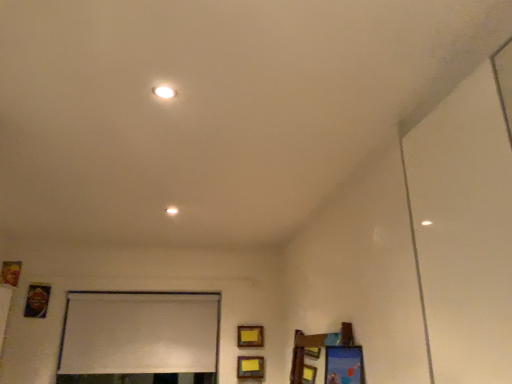
Question: Is metallic gold picture frame at lower left, which ranks as the 3th picture frame in bottom-to-top order, wider than matte yellow picture frame at center, the 2th picture frame from the bottom?

Choices:
 (A) yes
 (B) no

Answer: (A)

Question: Can you confirm if metallic gold picture frame at lower left, which ranks as the 3th picture frame in bottom-to-top order, is bigger than matte yellow picture frame at center, which appears as the fourth picture frame when viewed from the left?

Choices:
 (A) no
 (B) yes

Answer: (B)

Question: Would you say metallic gold picture frame at lower left, which is the 2th picture frame from top to bottom, contains matte yellow picture frame at center, arranged as the 3th picture frame when viewed from the top?

Choices:
 (A) yes
 (B) no

Answer: (B)

Question: Is metallic gold picture frame at lower left, positioned as the 2th picture frame in left-to-right order, not inside matte yellow picture frame at center, arranged as the 3th picture frame when viewed from the top?

Choices:
 (A) yes
 (B) no

Answer: (A)

Question: From the image's perspective, is metallic gold picture frame at lower left, which is the 2th picture frame from top to bottom, on top of matte yellow picture frame at center, arranged as the 3th picture frame when viewed from the top?

Choices:
 (A) yes
 (B) no

Answer: (A)

Question: From the image's perspective, is metallic gold picture frame at lower left, which ranks as the 3th picture frame in bottom-to-top order, beneath matte yellow picture frame at center, which appears as the fourth picture frame when viewed from the left?

Choices:
 (A) yes
 (B) no

Answer: (B)

Question: Is white matte window screen at lower center oriented away from wooden picture frame at left, the fourth picture frame positioned from the right?

Choices:
 (A) yes
 (B) no

Answer: (B)

Question: Is white matte window screen at lower center outside wooden picture frame at left, the first picture frame viewed from the left?

Choices:
 (A) no
 (B) yes

Answer: (B)

Question: Does white matte window screen at lower center have a greater width compared to wooden picture frame at left, the fourth picture frame positioned from the right?

Choices:
 (A) no
 (B) yes

Answer: (B)

Question: Considering the relative sizes of white matte window screen at lower center and wooden picture frame at left, the fourth picture frame positioned from the right, in the image provided, is white matte window screen at lower center smaller than wooden picture frame at left, the fourth picture frame positioned from the right,?

Choices:
 (A) yes
 (B) no

Answer: (B)

Question: Considering the relative positions of white matte window screen at lower center and wooden picture frame at left, arranged as the first picture frame when viewed from the top, in the image provided, is white matte window screen at lower center to the left of wooden picture frame at left, arranged as the first picture frame when viewed from the top, from the viewer's perspective?

Choices:
 (A) yes
 (B) no

Answer: (B)

Question: Would you say wooden picture frame at left, the 4th picture frame when ordered from bottom to top, is part of white matte window screen at lower center's contents?

Choices:
 (A) no
 (B) yes

Answer: (A)

Question: Does white glossy light at upper center have a smaller size compared to metallic gold picture frame at lower left, which ranks as the 3th picture frame in bottom-to-top order?

Choices:
 (A) no
 (B) yes

Answer: (B)